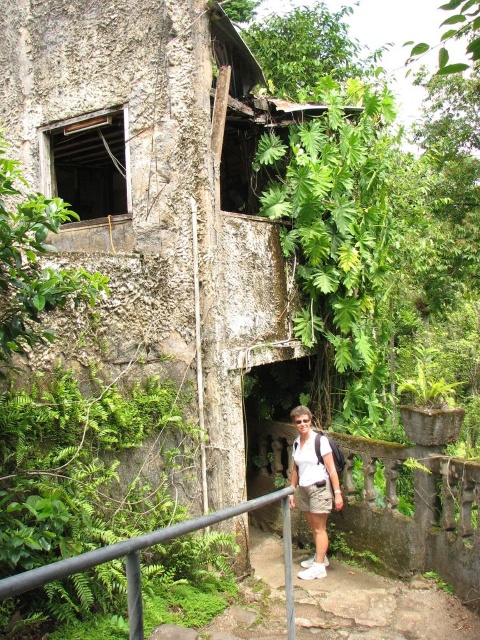
You are standing in front of the deteriorating structure and want to determine the relative positions of two points marked on the wall. Which point, point (478, 616) or point (140, 593), is closer to you?

Point (140, 593) is closer to you because it is less further to the camera than point (478, 616).